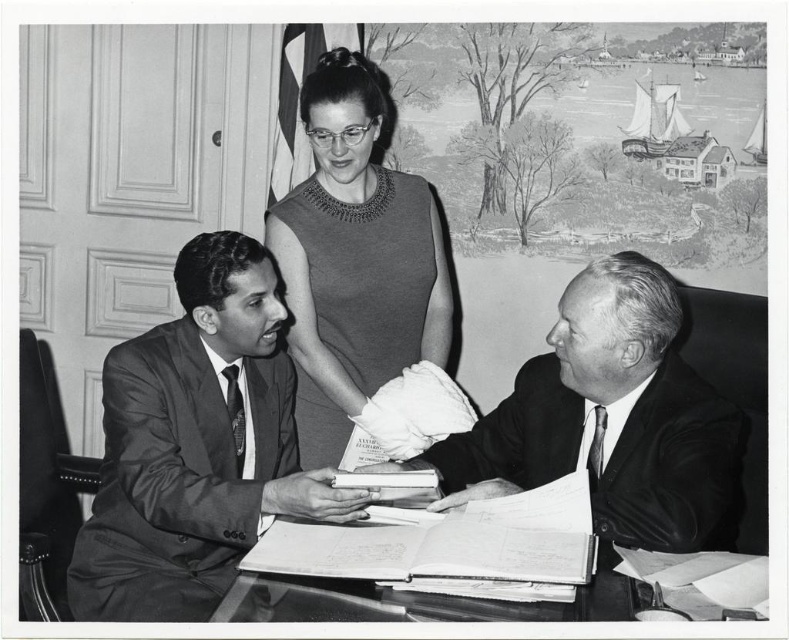
Question: In this image, where is smooth black suit at center located relative to smooth paper documents at center?

Choices:
 (A) left
 (B) right

Answer: (B)

Question: Can you confirm if smooth black suit at center is wider than smooth paper documents at center?

Choices:
 (A) no
 (B) yes

Answer: (A)

Question: Which object is positioned closest to the smooth paper documents at center?

Choices:
 (A) smooth suit at left
 (B) smooth black suit at center

Answer: (B)

Question: Among these points, which one is nearest to the camera?

Choices:
 (A) (217, 417)
 (B) (552, 560)
 (C) (574, 394)

Answer: (B)

Question: Observing the image, what is the correct spatial positioning of smooth suit at left in reference to smooth fabric dress at center?

Choices:
 (A) above
 (B) below

Answer: (B)

Question: Estimate the real-world distances between objects in this image. Which object is farther from the smooth fabric dress at center?

Choices:
 (A) smooth paper documents at center
 (B) smooth suit at left
 (C) smooth black suit at center

Answer: (A)